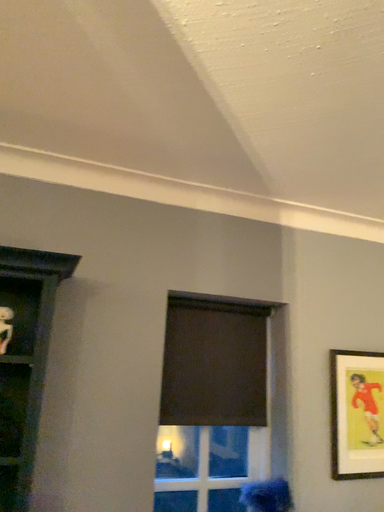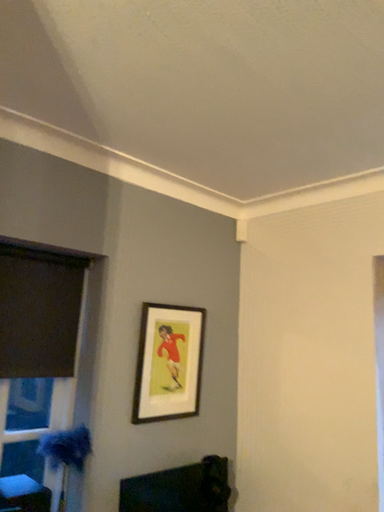
Question: Which way did the camera rotate in the video?

Choices:
 (A) rotated left
 (B) rotated right

Answer: (B)